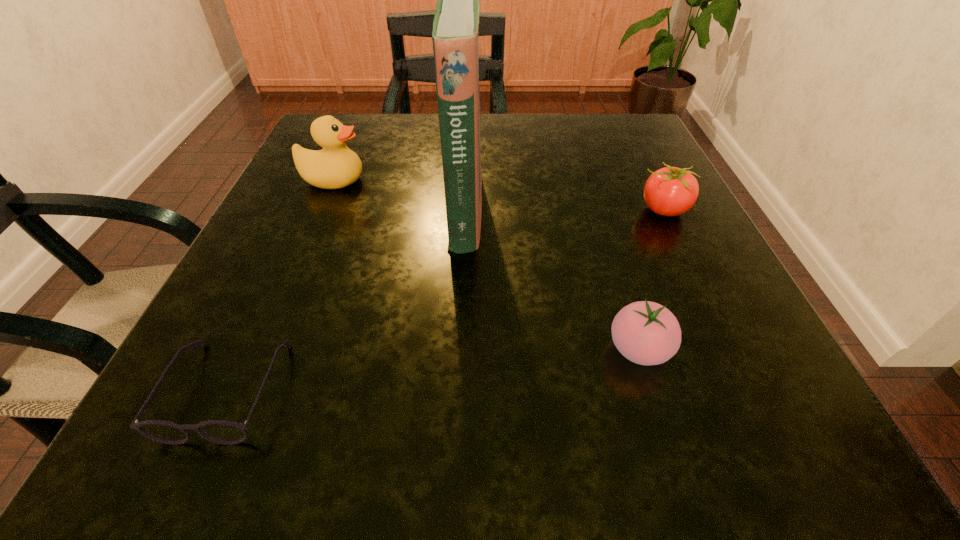
What are the coordinates of `free space at the far left corner of the desktop` in the screenshot? It's located at (384, 126).

This screenshot has width=960, height=540. I want to click on free space at the near left corner of the desktop, so click(157, 446).

The width and height of the screenshot is (960, 540). I want to click on free space at the far right corner, so click(x=636, y=128).

At what (x,y) coordinates should I click in order to perform the action: click on free space between the farther tomato and the second object from right to left. Please return your answer as a coordinate pair (x, y). This screenshot has height=540, width=960. Looking at the image, I should click on (651, 280).

At what (x,y) coordinates should I click in order to perform the action: click on free spot between the fourth object from left to right and the duck. Please return your answer as a coordinate pair (x, y). The image size is (960, 540). Looking at the image, I should click on (486, 265).

Image resolution: width=960 pixels, height=540 pixels. Find the location of `free space between the duck and the left tomato`. free space between the duck and the left tomato is located at coordinates (486, 265).

Image resolution: width=960 pixels, height=540 pixels. Find the location of `free space between the third object from right to left and the farther tomato`. free space between the third object from right to left and the farther tomato is located at coordinates point(564,210).

Image resolution: width=960 pixels, height=540 pixels. In order to click on vacant area that lies between the right tomato and the spectacles in this screenshot , I will do `click(445, 300)`.

At what (x,y) coordinates should I click in order to perform the action: click on vacant area between the nearer tomato and the shortest object. Please return your answer as a coordinate pair (x, y). The width and height of the screenshot is (960, 540). Looking at the image, I should click on (433, 369).

Find the location of a particular element. free space between the shortest object and the right tomato is located at coordinates (445, 300).